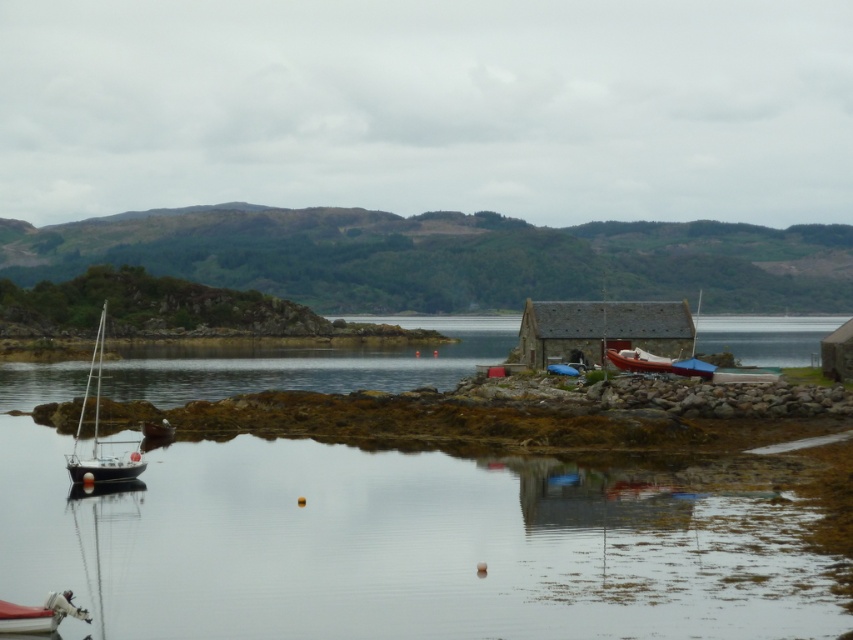
You are a small toy boat that is 10 cm wide. You want to sail from the white plastic boat at lower left to the clear water at lower left. Is there enough space between them for you to pass through?

The clear water at lower left might be wider than the white plastic boat at lower left, so there is likely enough space for the toy boat to pass through.

You are a photographer standing at the edge of the water. You want to capture a photo of the wooden boat at right without the clear water at lower left appearing in the foreground. Is this possible based on the scene?

The clear water at lower left is in front of the wooden boat at right, so it will block the view of the boat. You cannot take a photo of the wooden boat at right without the clear water at lower left appearing in the foreground.